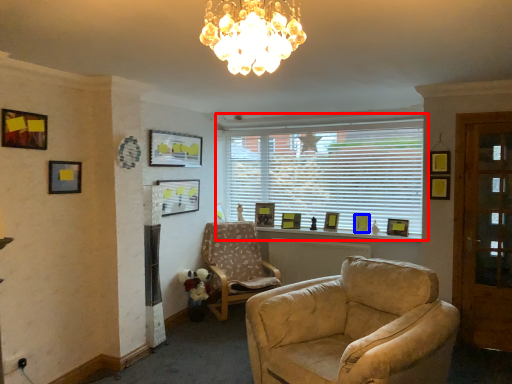
Question: Which object appears closest to the camera in this image, window (highlighted by a red box) or picture frame (highlighted by a blue box)?

Choices:
 (A) window
 (B) picture frame

Answer: (A)